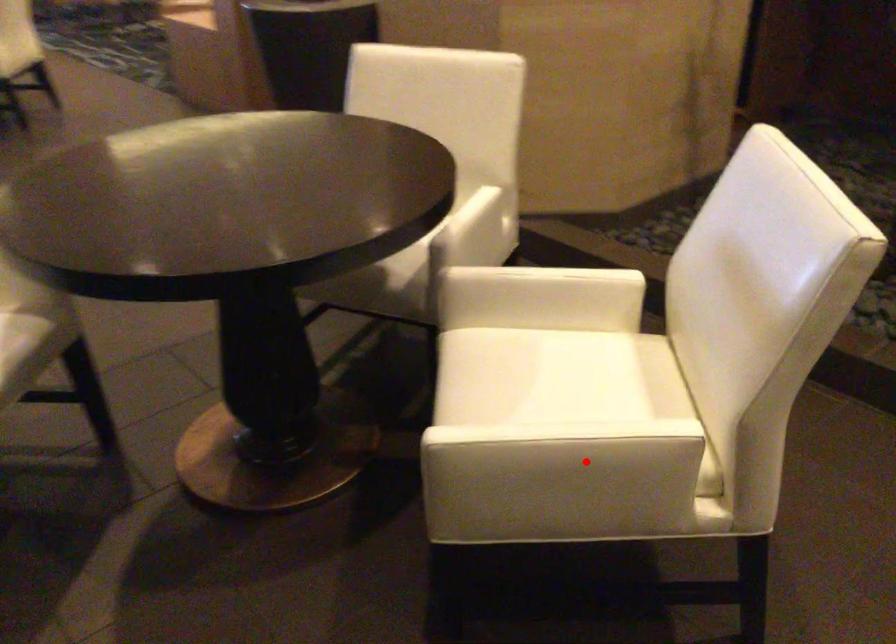
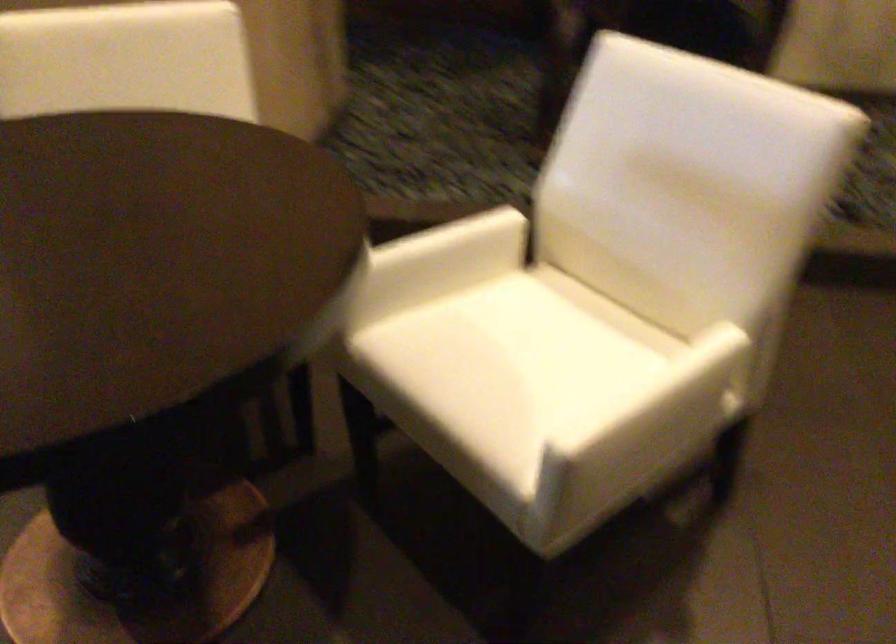
Where in the second image is the point corresponding to the highlighted location from the first image?

(684, 402)